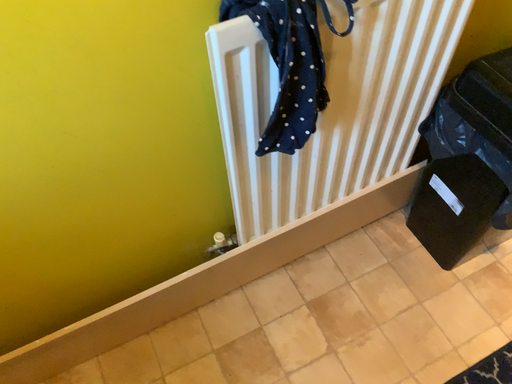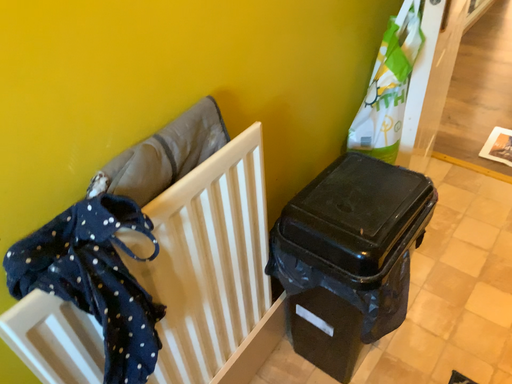
Question: How did the camera likely rotate when shooting the video?

Choices:
 (A) rotated left
 (B) rotated right

Answer: (B)